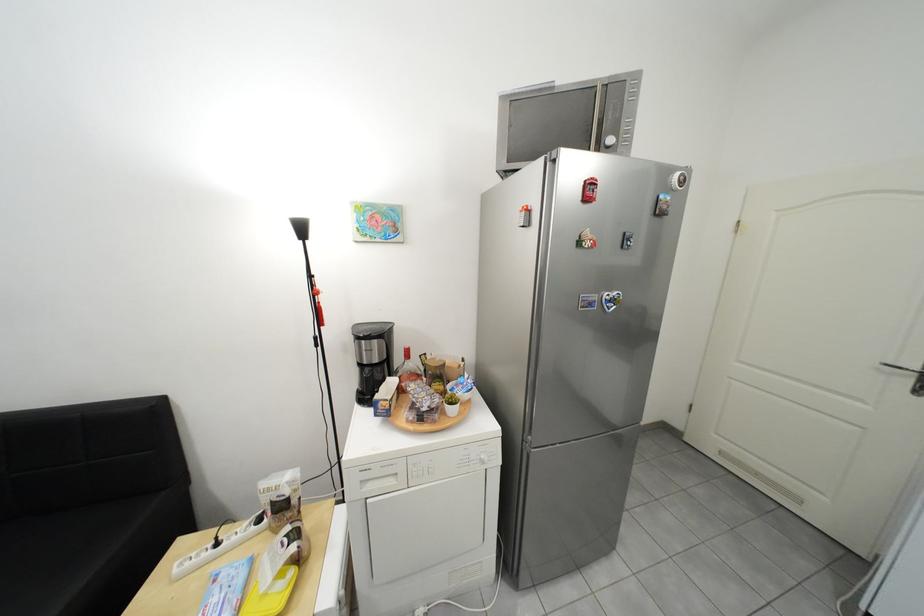
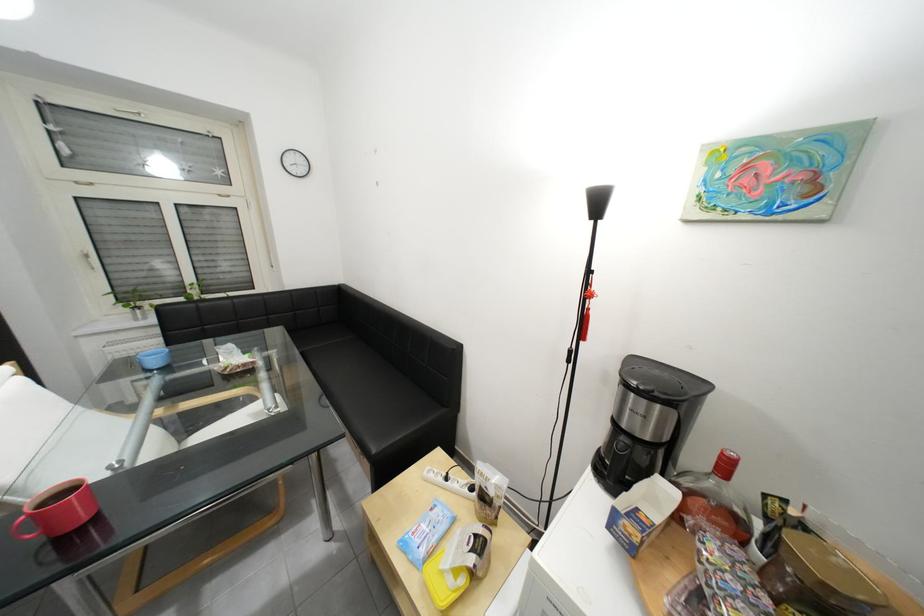
Where in the second image is the point corresponding to the point at 399,379 from the first image?

(671, 480)